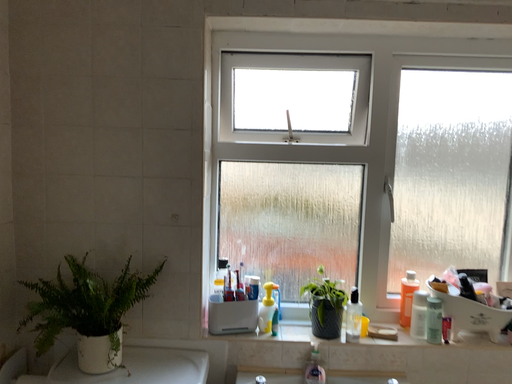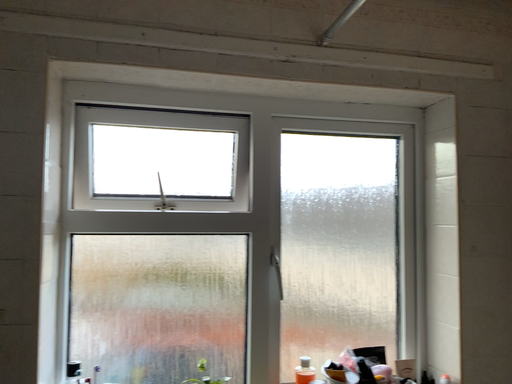
Question: How did the camera likely rotate when shooting the video?

Choices:
 (A) rotated downward
 (B) rotated upward

Answer: (B)